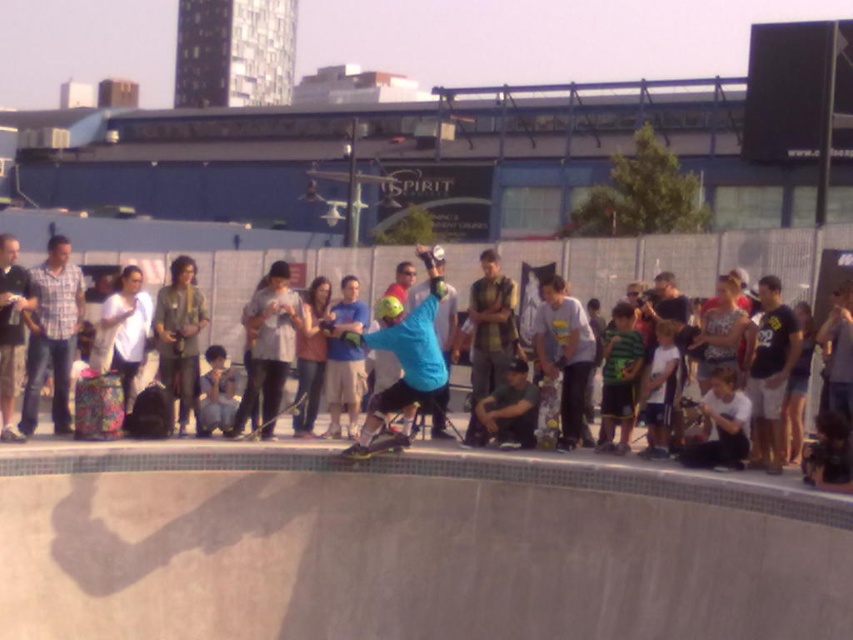
Who is positioned more to the right, matte black skateboarder at center or black matte skateboard at center?

From the viewer's perspective, black matte skateboard at center appears more on the right side.

What do you see at coordinates (682, 259) in the screenshot? I see `matte black skateboarder at center` at bounding box center [682, 259].

You are a GUI agent. You are given a task and a screenshot of the screen. Output one action in this format:
    pyautogui.click(x=<x>, y=<y>)
    Task: Click on the matte black skateboarder at center
    
    Given the screenshot: What is the action you would take?
    [x=682, y=259]

Is point (569, 332) in front of point (494, 371)?

Yes, point (569, 332) is in front of point (494, 371).

Which is behind, point (572, 308) or point (477, 310)?

The point (477, 310) is more distant.

Where is `light blue t-shirt at center`? light blue t-shirt at center is located at coordinates (564, 353).

Does light blue t-shirt at center have a greater height compared to wooden skateboard at center?

Correct, light blue t-shirt at center is much taller as wooden skateboard at center.

Does light blue t-shirt at center appear on the right side of wooden skateboard at center?

Correct, you'll find light blue t-shirt at center to the right of wooden skateboard at center.

Is point (567, 426) behind point (247, 436)?

That is True.

Where is `light blue t-shirt at center`? light blue t-shirt at center is located at coordinates click(564, 353).